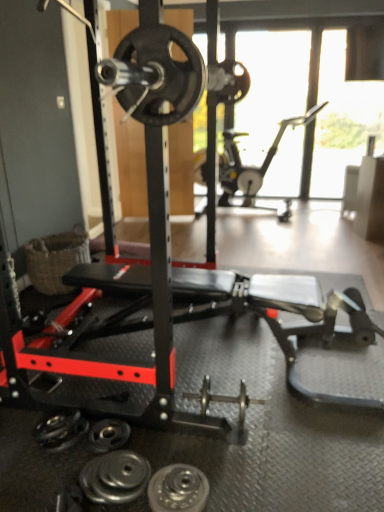
Where is `free space behind silver metallic weight plate at lower center, the 2th wheel positioned from the back`? free space behind silver metallic weight plate at lower center, the 2th wheel positioned from the back is located at coordinates (183, 451).